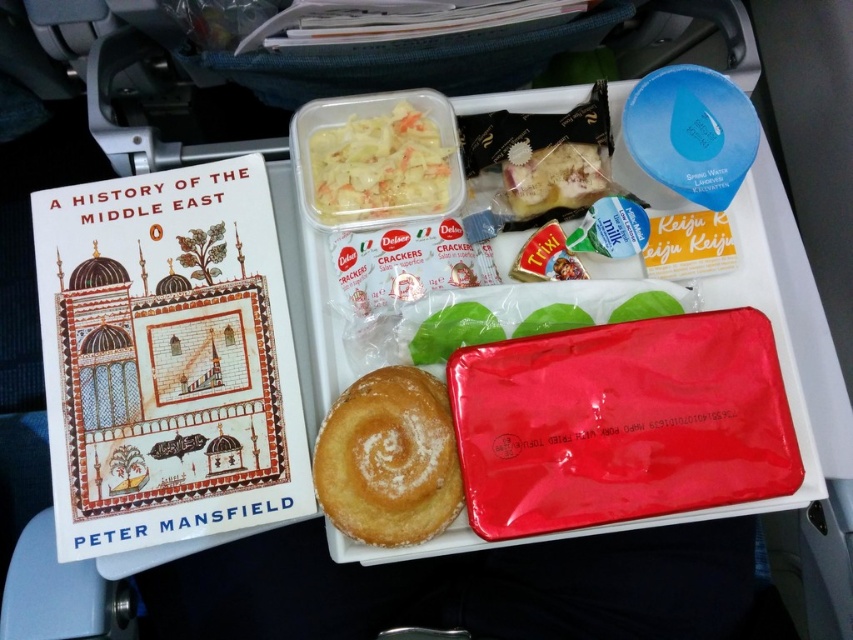
Question: Is matte plastic tray at center wider than white creamy salad at upper center?

Choices:
 (A) no
 (B) yes

Answer: (B)

Question: Estimate the real-world distances between objects in this image. Which object is farther from the sugared golden pastry at center?

Choices:
 (A) matte plastic tray at center
 (B) yellow cheese at center

Answer: (B)

Question: Which of the following is the farthest from the observer?

Choices:
 (A) sugared golden pastry at center
 (B) yellow cheese at center

Answer: (B)

Question: Is white creamy salad at upper center to the left of yellow cheese at center from the viewer's perspective?

Choices:
 (A) no
 (B) yes

Answer: (B)

Question: Does matte plastic tray at center appear on the left side of white creamy salad at upper center?

Choices:
 (A) no
 (B) yes

Answer: (A)

Question: Among these objects, which one is farthest from the camera?

Choices:
 (A) white creamy salad at upper center
 (B) sugared golden pastry at center
 (C) matte plastic tray at center

Answer: (A)